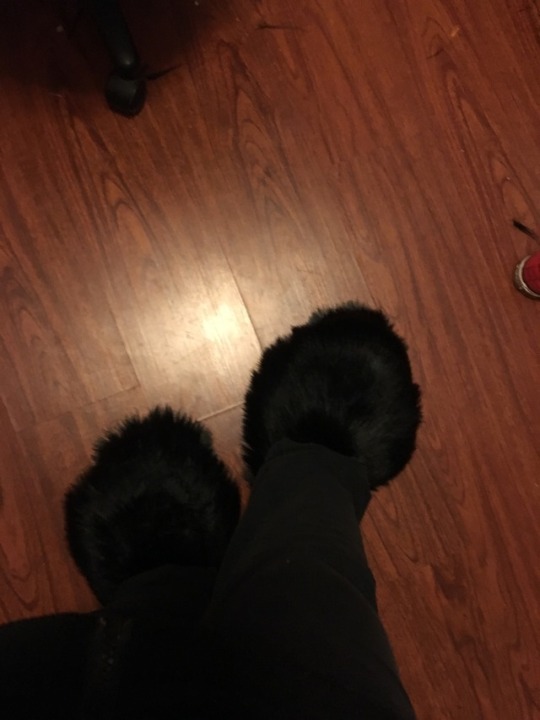
Locate an element on the screen. This screenshot has height=720, width=540. wood floor, brown is located at coordinates (141, 171).